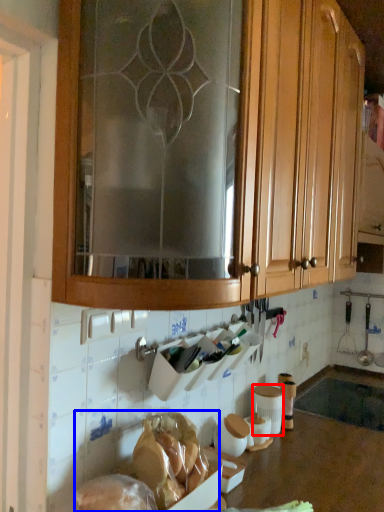
Question: Which of the following is the closest to the observer, pottery (highlighted by a red box) or food (highlighted by a blue box)?

Choices:
 (A) pottery
 (B) food

Answer: (B)